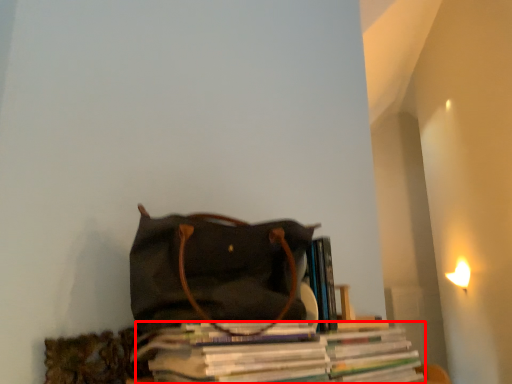
Question: In this image, where is magazine (annotated by the red box) located relative to handbag?

Choices:
 (A) right
 (B) left

Answer: (A)